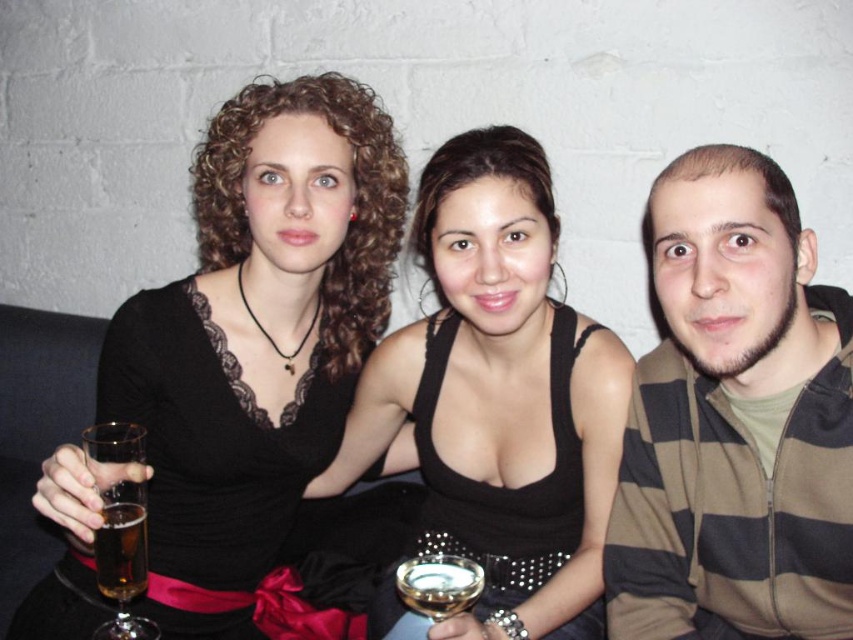
You are a photographer adjusting the focus on your camera. You need to ensure both the black satin dress at center and the gold metallic wine glass at center are in focus. Which object should you focus on first to ensure proper depth of field?

The black satin dress at center has a greater height compared to the gold metallic wine glass at center, so you should focus on the black satin dress at center first to ensure proper depth of field.

Which object is positioned to the right of the other between the striped hoodie at right and the translucent glass at left?

The striped hoodie at right is positioned to the right of the translucent glass at left.